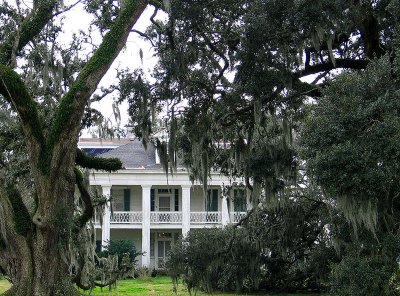
At what (x,y) coordinates should I click in order to perform the action: click on shutters. Please return your answer as a coordinate pair (x, y). This screenshot has height=296, width=400. Looking at the image, I should click on (125, 202), (213, 200).